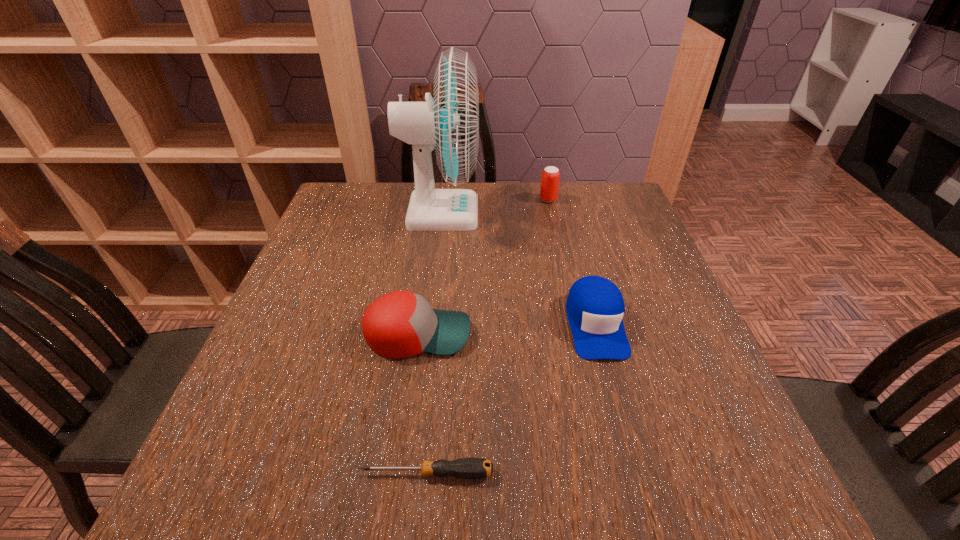
This screenshot has width=960, height=540. Find the location of `the tallest object`. the tallest object is located at coordinates (449, 123).

You are a GUI agent. You are given a task and a screenshot of the screen. Output one action in this format:
    pyautogui.click(x=<x>, y=<y>)
    Task: Click on the beer can
    The width and height of the screenshot is (960, 540).
    Given the screenshot: What is the action you would take?
    pyautogui.click(x=550, y=176)

This screenshot has width=960, height=540. Identify the location of the left baseball cap. (400, 324).

Locate an element on the screen. The width and height of the screenshot is (960, 540). the right baseball cap is located at coordinates (595, 307).

What are the coordinates of `the nearest object` in the screenshot? It's located at (464, 468).

Locate an element on the screen. This screenshot has width=960, height=540. screwdriver is located at coordinates (464, 468).

Image resolution: width=960 pixels, height=540 pixels. Find the location of `free space located 0.250m in front of the fan to face the airflow`. free space located 0.250m in front of the fan to face the airflow is located at coordinates (566, 213).

Find the location of a particular element. The width and height of the screenshot is (960, 540). vacant region located on the left of the beer can is located at coordinates (479, 199).

Find the location of a particular element. The width and height of the screenshot is (960, 540). vacant space located at the brim of the left baseball cap is located at coordinates (563, 334).

At what (x,y) coordinates should I click in order to perform the action: click on free space located 0.190m on the front-facing side of the right baseball cap. Please return your answer as a coordinate pair (x, y). The image size is (960, 540). Looking at the image, I should click on (630, 455).